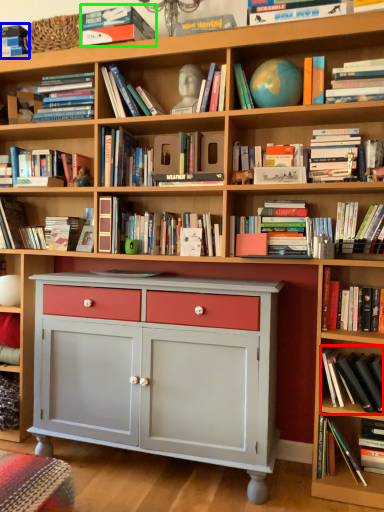
Question: Based on their relative distances, which object is farther from book (highlighted by a red box)? Choose from book (highlighted by a blue box) and book (highlighted by a green box).

Choices:
 (A) book
 (B) book

Answer: (A)